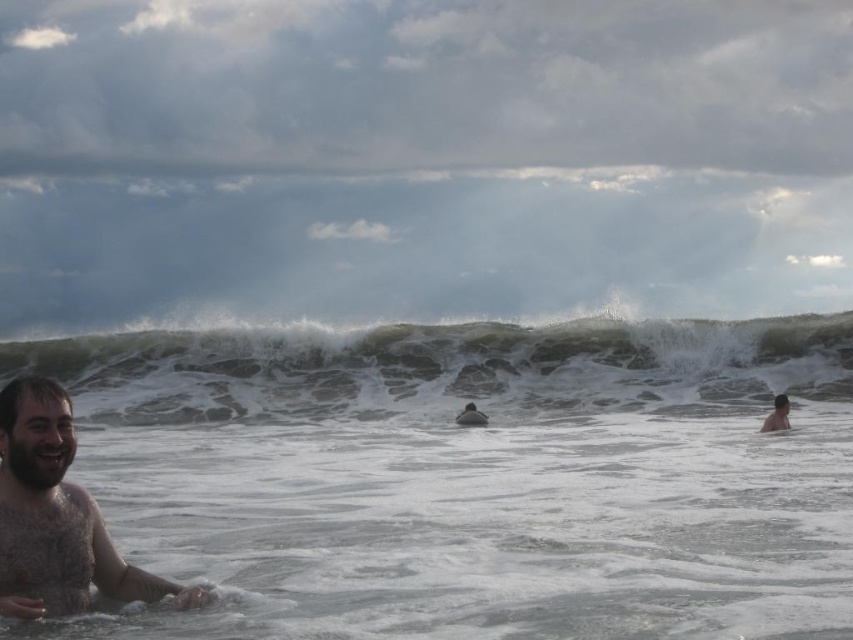
Question: Which of the following is the closest to the observer?

Choices:
 (A) (767, 417)
 (B) (477, 321)
 (C) (142, 593)

Answer: (C)

Question: Is gray cloudy sky at upper center wider than brown leather surfboard at center?

Choices:
 (A) yes
 (B) no

Answer: (A)

Question: Can you confirm if white frothy wave at center is thinner than bearded wet man at left?

Choices:
 (A) no
 (B) yes

Answer: (A)

Question: Is gray cloudy sky at upper center smaller than brown leather surfboard at center?

Choices:
 (A) no
 (B) yes

Answer: (A)

Question: Which of these objects is positioned closest to the brown leather surfboard at center?

Choices:
 (A) skinny white man at lower right
 (B) gray cloudy sky at upper center
 (C) white frothy wave at center

Answer: (C)

Question: Which point is closer to the camera taking this photo?

Choices:
 (A) (62, 406)
 (B) (465, 410)

Answer: (A)